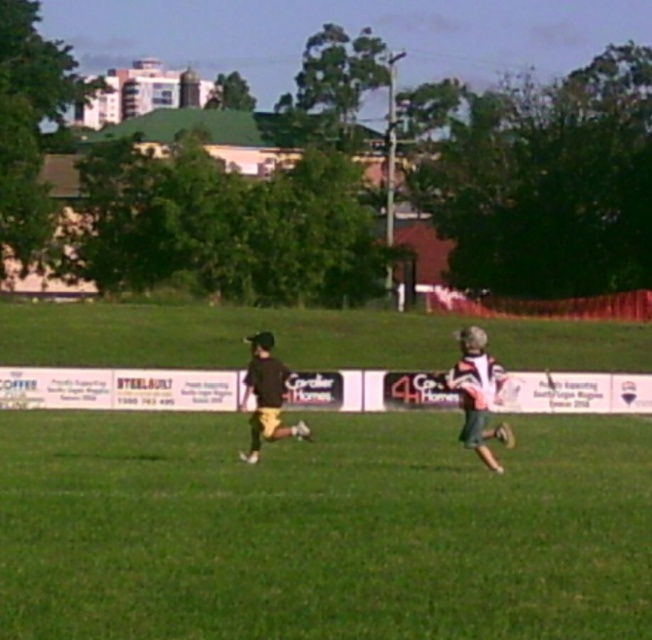
You are a photographer trying to capture both the striped jersey at right and the dark brown jersey at center in a single shot. Based on their positions, which jersey is positioned further to the right?

The striped jersey at right is positioned to the right of the dark brown jersey at center, so the striped jersey at right is further to the right.

You are a photographer trying to capture a photo of the green grass at center and the dark brown jersey at center. Based on their widths, which object should you focus on to ensure it fits entirely within the frame?

The green grass at center might be wider than dark brown jersey at center, so focusing on the green grass at center would ensure it fits entirely within the frame.

You are a photographer setting up a shot of the green grass at center and the striped jersey at right. If you want to emphasize the grass, which object should you focus on and why?

You should focus on the green grass at center because its width is larger than the striped jersey at right, making it a more prominent subject in the scene.